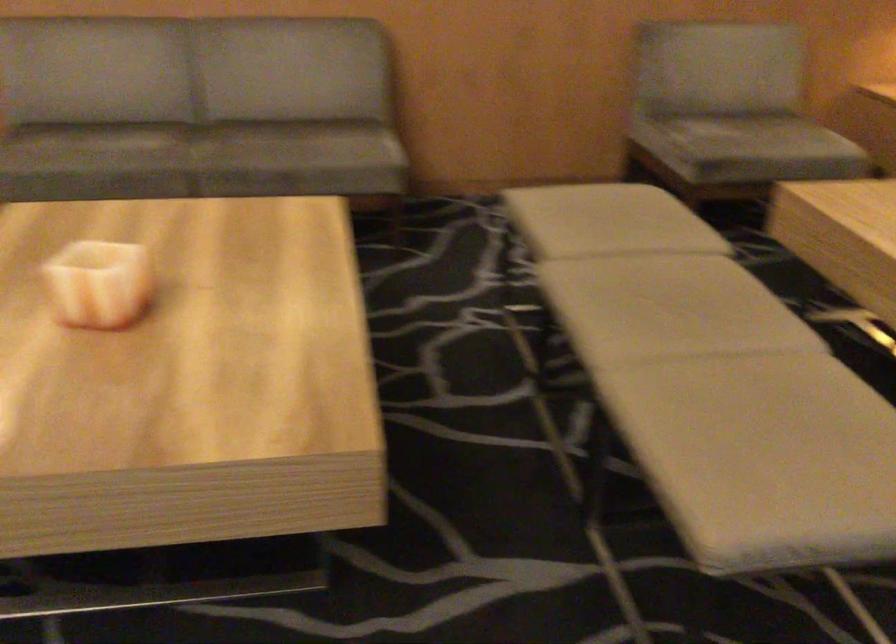
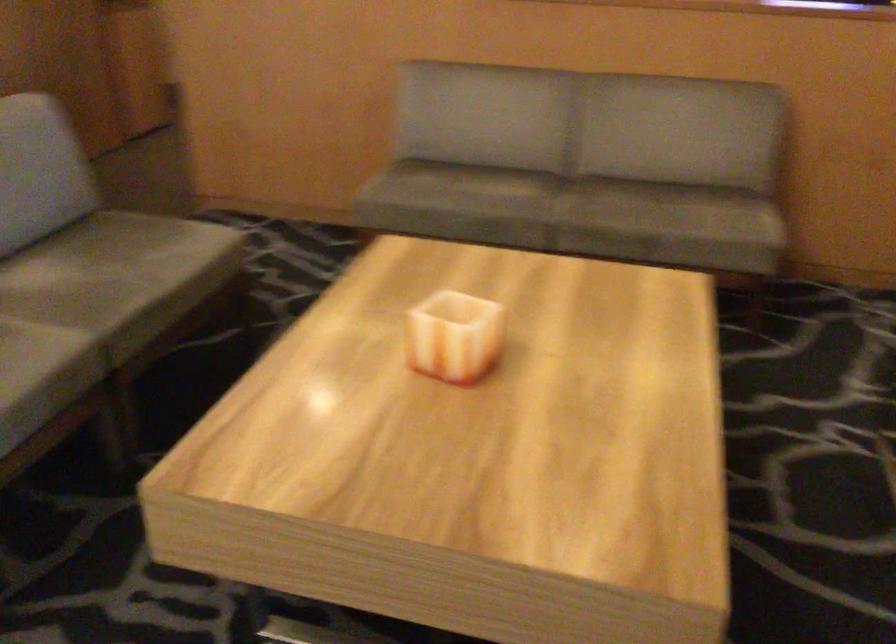
Question: The camera is either moving clockwise (left) or counter-clockwise (right) around the object. The first image is from the beginning of the video and the second image is from the end. Is the camera moving left or right when shooting the video?

Choices:
 (A) Left
 (B) Right

Answer: (B)